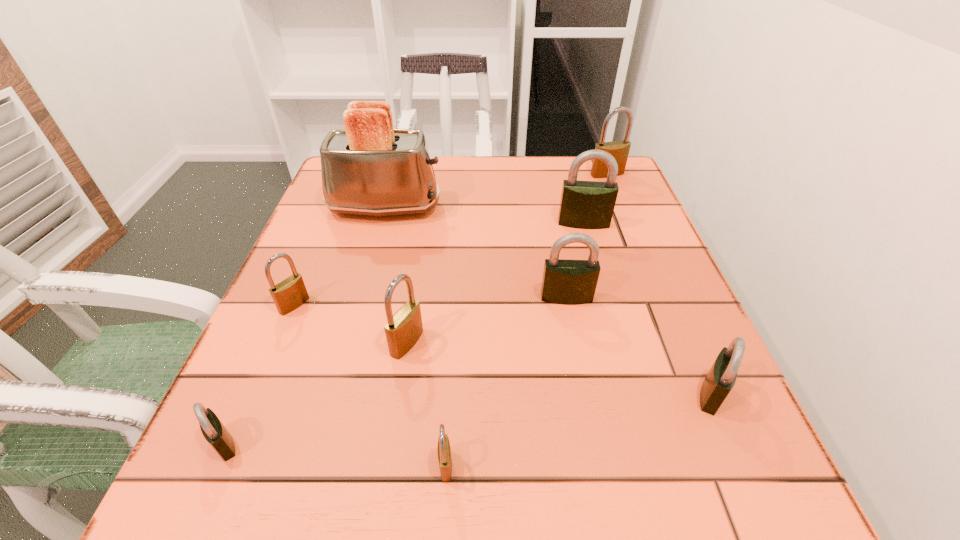
You are a GUI agent. You are given a task and a screenshot of the screen. Output one action in this format:
    pyautogui.click(x=<x>, y=<y>)
    Task: Click on the free space located 0.050m on the right of the third smallest black padlock
    The image size is (960, 540).
    Given the screenshot: What is the action you would take?
    pyautogui.click(x=618, y=298)

I want to click on free region located on the front of the fifth farthest padlock, so click(386, 484).

The width and height of the screenshot is (960, 540). Find the location of `vacant space located 0.250m on the right of the third nearest brass padlock`. vacant space located 0.250m on the right of the third nearest brass padlock is located at coordinates (443, 305).

Find the location of a particular element. free space located on the front of the second nearest black padlock is located at coordinates (x=745, y=470).

Locate an element on the screen. The width and height of the screenshot is (960, 540). vacant area located on the right of the leftmost black padlock is located at coordinates (440, 443).

In order to click on free space located 0.150m on the left of the smallest brass padlock in this screenshot , I will do `click(328, 465)`.

Find the location of a particular element. This screenshot has height=540, width=960. toaster located in the far edge section of the desktop is located at coordinates (369, 168).

The width and height of the screenshot is (960, 540). In order to click on padlock at the far edge in this screenshot , I will do `click(619, 150)`.

Where is `toaster present at the left edge`? The image size is (960, 540). toaster present at the left edge is located at coordinates (369, 168).

Where is `object that is at the far left corner`? The height and width of the screenshot is (540, 960). object that is at the far left corner is located at coordinates (369, 168).